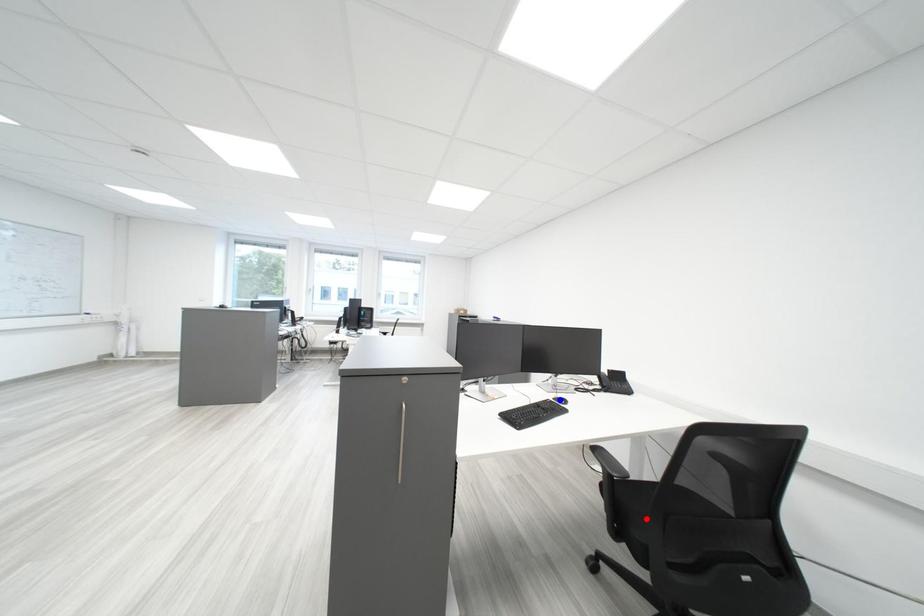
Question: In the image, two points are highlighted. Which point is nearer to the camera? Reply with the corresponding letter.

Choices:
 (A) blue point
 (B) red point

Answer: (B)